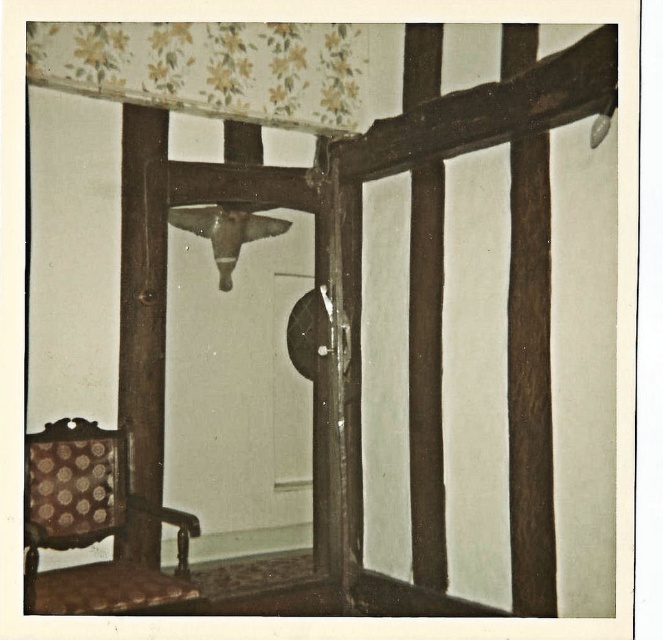
Question: Can you confirm if floral wallpaper at upper center is smaller than metallic brass lamp at center?

Choices:
 (A) yes
 (B) no

Answer: (B)

Question: Is floral wallpaper at upper center below patterned fabric chair at lower left?

Choices:
 (A) no
 (B) yes

Answer: (A)

Question: Estimate the real-world distances between objects in this image. Which object is farther from the dark brown wood at center?

Choices:
 (A) metallic brass lamp at center
 (B) patterned fabric chair at lower left

Answer: (B)

Question: Is floral wallpaper at upper center positioned behind dark brown wood at center?

Choices:
 (A) yes
 (B) no

Answer: (A)

Question: Which point is farther from the camera taking this photo?

Choices:
 (A) (518, 198)
 (B) (170, 33)
 (C) (66, 576)

Answer: (B)

Question: Which is nearer to the metallic brass lamp at center?

Choices:
 (A) dark brown wood at center
 (B) floral wallpaper at upper center

Answer: (B)